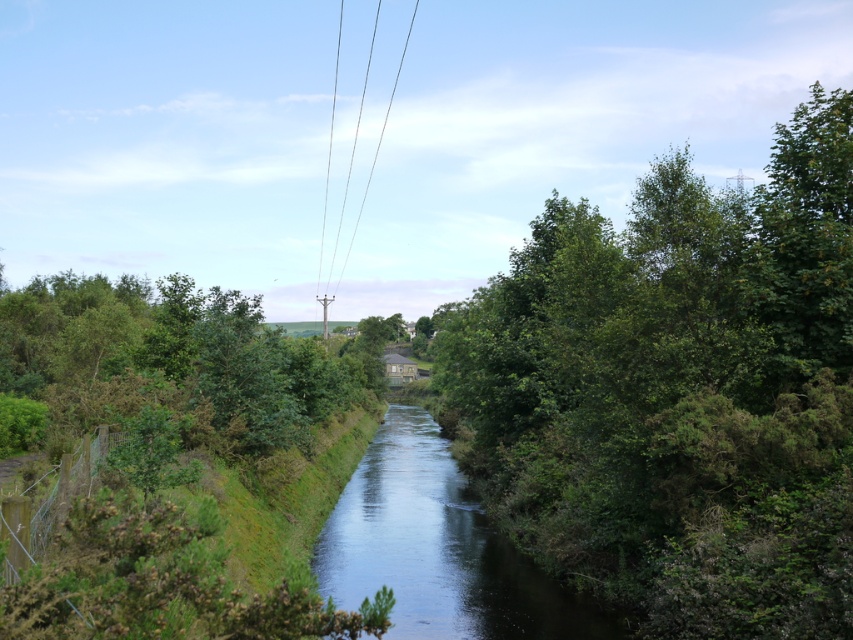
Question: Is green leafy tree at center right thinner than metallic wire at center?

Choices:
 (A) no
 (B) yes

Answer: (A)

Question: Which of these objects is positioned farthest from the green leafy tree at left?

Choices:
 (A) metallic wire at center
 (B) green leafy tree at center right
 (C) clear water at center

Answer: (A)

Question: Which of these objects is positioned farthest from the metallic wire at center?

Choices:
 (A) clear water at center
 (B) green leafy tree at left

Answer: (A)

Question: Is green leafy tree at left below clear water at center?

Choices:
 (A) yes
 (B) no

Answer: (B)

Question: Is green leafy tree at center right bigger than clear water at center?

Choices:
 (A) yes
 (B) no

Answer: (A)

Question: Which point is closer to the camera?

Choices:
 (A) (341, 266)
 (B) (500, 589)
 (C) (16, 440)

Answer: (B)